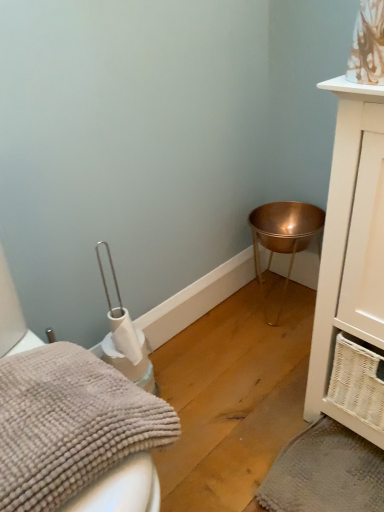
Question: Is point (337, 333) positioned closer to the camera than point (268, 202)?

Choices:
 (A) farther
 (B) closer

Answer: (B)

Question: Is white wicker cabinet at right wider or thinner than copper metallic bowl at lower right?

Choices:
 (A) wide
 (B) thin

Answer: (A)

Question: Which is farther from the gray fluffy bath towel at lower left, the 1th bath towel viewed from the top?

Choices:
 (A) copper metallic bowl at lower right
 (B) gray textured bath towel at lower right, marked as the 1th bath towel in a right-to-left arrangement
 (C) white wicker cabinet at right

Answer: (A)

Question: Estimate the real-world distances between objects in this image. Which object is farther from the white wicker cabinet at right?

Choices:
 (A) gray fluffy bath towel at lower left, the 2th bath towel from the right
 (B) gray textured bath towel at lower right, placed as the first bath towel when sorted from back to front
 (C) copper metallic bowl at lower right

Answer: (C)